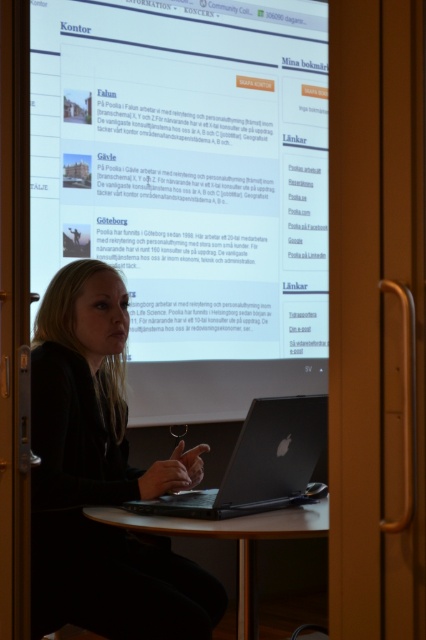
Question: Which object is farther from the camera taking this photo?

Choices:
 (A) sleek silver laptop at center
 (B) black matte jacket at center
 (C) white glossy projection screen at upper center

Answer: (C)

Question: Where is sleek silver laptop at center located in relation to brown wooden table at center in the image?

Choices:
 (A) below
 (B) above

Answer: (B)

Question: Does white glossy projection screen at upper center come behind brown wooden table at center?

Choices:
 (A) no
 (B) yes

Answer: (B)

Question: Among these objects, which one is nearest to the camera?

Choices:
 (A) black matte jacket at center
 (B) sleek silver laptop at center

Answer: (A)

Question: Which object is positioned farthest from the black matte jacket at center?

Choices:
 (A) sleek silver laptop at center
 (B) white glossy projection screen at upper center

Answer: (B)

Question: Considering the relative positions of sleek silver laptop at center and brown wooden table at center in the image provided, where is sleek silver laptop at center located with respect to brown wooden table at center?

Choices:
 (A) right
 (B) left

Answer: (A)